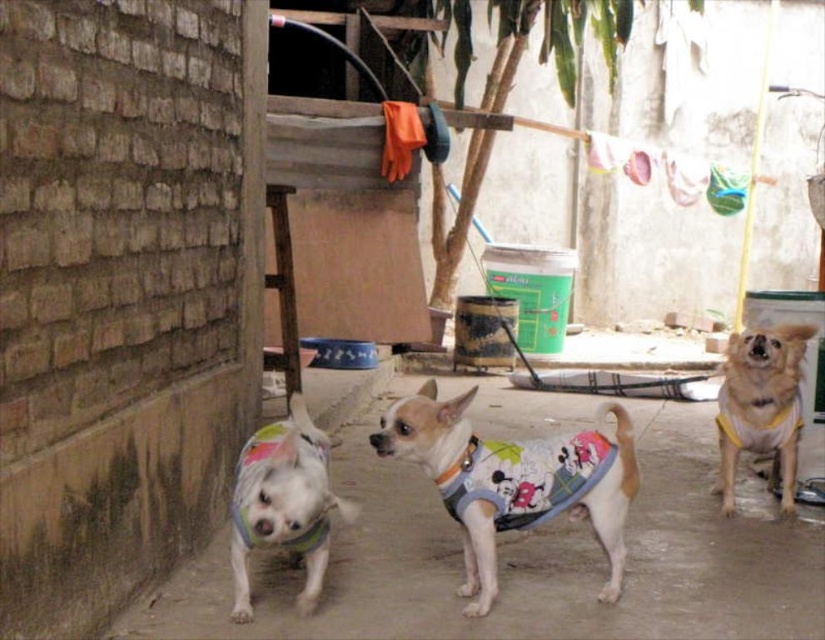
Is white fabric dog at center thinner than white soft fabric dog at center?

No.

How much distance is there between white fabric dog at center and white soft fabric dog at center?

white fabric dog at center and white soft fabric dog at center are 51.41 centimeters apart from each other.

This screenshot has height=640, width=825. Describe the element at coordinates (512, 481) in the screenshot. I see `white fabric dog at center` at that location.

Find the location of a particular element. white fabric dog at center is located at coordinates (512, 481).

Based on the photo, does white soft fabric dog at center appear on the left side of yellow fabric dog at center?

Yes, white soft fabric dog at center is to the left of yellow fabric dog at center.

Between white soft fabric dog at center and yellow fabric dog at center, which one appears on the right side from the viewer's perspective?

From the viewer's perspective, yellow fabric dog at center appears more on the right side.

This screenshot has width=825, height=640. I want to click on white soft fabric dog at center, so click(x=283, y=502).

Describe the element at coordinates (512, 481) in the screenshot. I see `white fabric dog at center` at that location.

Can you confirm if white fabric dog at center is taller than yellow fabric dog at center?

Incorrect, white fabric dog at center's height is not larger of yellow fabric dog at center's.

Does point (456, 451) lie behind point (733, 339)?

No, (456, 451) is in front of (733, 339).

Where is `white fabric dog at center`? white fabric dog at center is located at coordinates point(512,481).